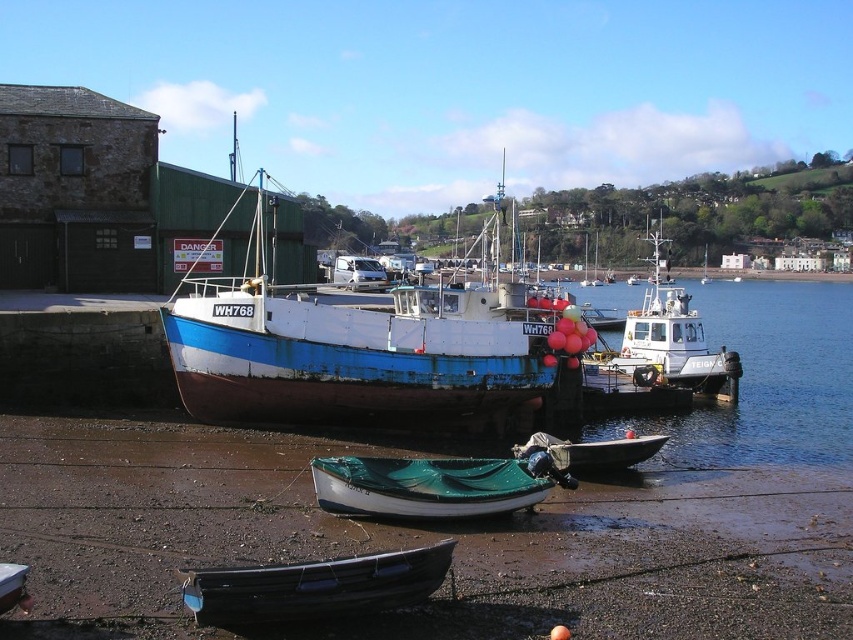
Question: Does blue painted wooden boat at center have a greater width compared to green tarpaulin boat at lower center?

Choices:
 (A) yes
 (B) no

Answer: (A)

Question: Is green tarpaulin boat at lower center above white matte tugboat at center-right?

Choices:
 (A) no
 (B) yes

Answer: (A)

Question: Considering the real-world distances, which object is farthest from the green tarpaulin boat at lower center?

Choices:
 (A) white matte tugboat at center-right
 (B) black plastic boat at lower center
 (C) blue painted wooden boat at center

Answer: (A)

Question: Among these objects, which one is farthest from the camera?

Choices:
 (A) green tarpaulin boat at lower center
 (B) white matte tugboat at center-right
 (C) black plastic boat at lower center

Answer: (B)

Question: In this image, where is blue painted wooden boat at center located relative to white matte tugboat at center-right?

Choices:
 (A) above
 (B) below

Answer: (A)

Question: Which object is positioned farthest from the black plastic boat at lower center?

Choices:
 (A) blue painted wooden boat at center
 (B) green tarpaulin boat at lower center
 (C) white matte tugboat at center-right

Answer: (C)